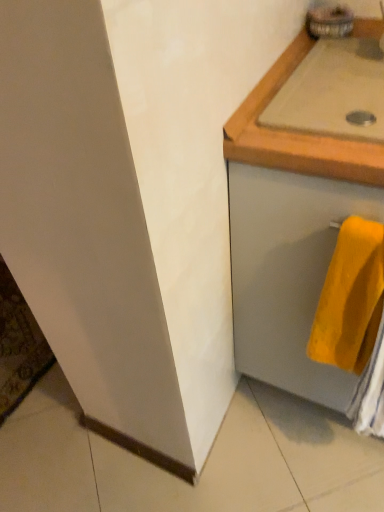
I want to click on yellow soft towel at lower right, so click(x=350, y=298).

From a real-world perspective, between yellow soft towel at lower right and beige wood countertop at upper right, who is vertically lower?

yellow soft towel at lower right.

Are yellow soft towel at lower right and beige wood countertop at upper right making contact?

yellow soft towel at lower right and beige wood countertop at upper right are clearly separated.

Based on the photo, is yellow soft towel at lower right wider or thinner than beige wood countertop at upper right?

Clearly, yellow soft towel at lower right has less width compared to beige wood countertop at upper right.

How different are the orientations of yellow soft towel at lower right and beige wood countertop at upper right in degrees?

They differ by 0.573 degrees in their facing directions.

This screenshot has width=384, height=512. In order to click on towel that is under the beige wood countertop at upper right (from a real-world perspective) in this screenshot , I will do coord(350,298).

How much distance is there between beige wood countertop at upper right and yellow soft towel at lower right?

beige wood countertop at upper right is 23.07 centimeters away from yellow soft towel at lower right.

Is beige wood countertop at upper right further to camera compared to yellow soft towel at lower right?

Yes, beige wood countertop at upper right is further from the viewer.

From the image's perspective, is yellow soft towel at lower right on matte gray drawer at right?

No.

Do you think yellow soft towel at lower right is within matte gray drawer at right, or outside of it?

yellow soft towel at lower right is inside matte gray drawer at right.

Does yellow soft towel at lower right have a smaller size compared to matte gray drawer at right?

Yes.

Can you confirm if yellow soft towel at lower right is positioned to the right of matte gray drawer at right?

In fact, yellow soft towel at lower right is to the left of matte gray drawer at right.

Is matte gray drawer at right oriented towards beige wood countertop at upper right?

No.

Considering the relative sizes of matte gray drawer at right and beige wood countertop at upper right in the image provided, is matte gray drawer at right wider than beige wood countertop at upper right?

Correct, the width of matte gray drawer at right exceeds that of beige wood countertop at upper right.

I want to click on countertop located on the left of matte gray drawer at right, so click(296, 134).

Does matte gray drawer at right contain beige wood countertop at upper right?

Yes, beige wood countertop at upper right can be found within matte gray drawer at right.

From a real-world perspective, which is physically above, matte gray drawer at right or yellow soft towel at lower right?

yellow soft towel at lower right is physically above.

In the scene shown: Considering the sizes of objects matte gray drawer at right and yellow soft towel at lower right in the image provided, who is shorter, matte gray drawer at right or yellow soft towel at lower right?

With less height is yellow soft towel at lower right.

Which object is wider, matte gray drawer at right or yellow soft towel at lower right?

Wider between the two is matte gray drawer at right.

What's the angular difference between matte gray drawer at right and yellow soft towel at lower right's facing directions?

They differ by 0.00184 degrees in their facing directions.

From their relative heights in the image, would you say beige wood countertop at upper right is taller or shorter than matte gray drawer at right?

beige wood countertop at upper right is shorter than matte gray drawer at right.

Looking at this image, is beige wood countertop at upper right touching matte gray drawer at right?

No, beige wood countertop at upper right is not next to matte gray drawer at right.

Is beige wood countertop at upper right located outside matte gray drawer at right?

No, beige wood countertop at upper right is not outside of matte gray drawer at right.

Which object is wider, beige wood countertop at upper right or matte gray drawer at right?

Wider between the two is matte gray drawer at right.

Locate an element on the screen. The width and height of the screenshot is (384, 512). countertop above the yellow soft towel at lower right (from the image's perspective) is located at coordinates pyautogui.click(x=296, y=134).

Where is `countertop on the right of yellow soft towel at lower right`? countertop on the right of yellow soft towel at lower right is located at coordinates click(296, 134).

Estimate the real-world distances between objects in this image. Which object is closer to matte gray drawer at right, beige wood countertop at upper right or yellow soft towel at lower right?

yellow soft towel at lower right is closer to matte gray drawer at right.

Looking at the image, which one is located further to yellow soft towel at lower right, beige wood countertop at upper right or matte gray drawer at right?

beige wood countertop at upper right is further to yellow soft towel at lower right.

Which object lies nearer to the anchor point beige wood countertop at upper right, yellow soft towel at lower right or matte gray drawer at right?

yellow soft towel at lower right lies closer to beige wood countertop at upper right than the other object.

Looking at the image, which one is located further to beige wood countertop at upper right, matte gray drawer at right or yellow soft towel at lower right?

matte gray drawer at right lies further to beige wood countertop at upper right than the other object.

Looking at the image, which one is located further to yellow soft towel at lower right, matte gray drawer at right or beige wood countertop at upper right?

beige wood countertop at upper right is positioned further to the anchor yellow soft towel at lower right.

Looking at the image, which one is located closer to matte gray drawer at right, yellow soft towel at lower right or beige wood countertop at upper right?

The object closer to matte gray drawer at right is yellow soft towel at lower right.

Where is `drawer between beige wood countertop at upper right and yellow soft towel at lower right from top to bottom`? Image resolution: width=384 pixels, height=512 pixels. drawer between beige wood countertop at upper right and yellow soft towel at lower right from top to bottom is located at coordinates pyautogui.click(x=289, y=275).